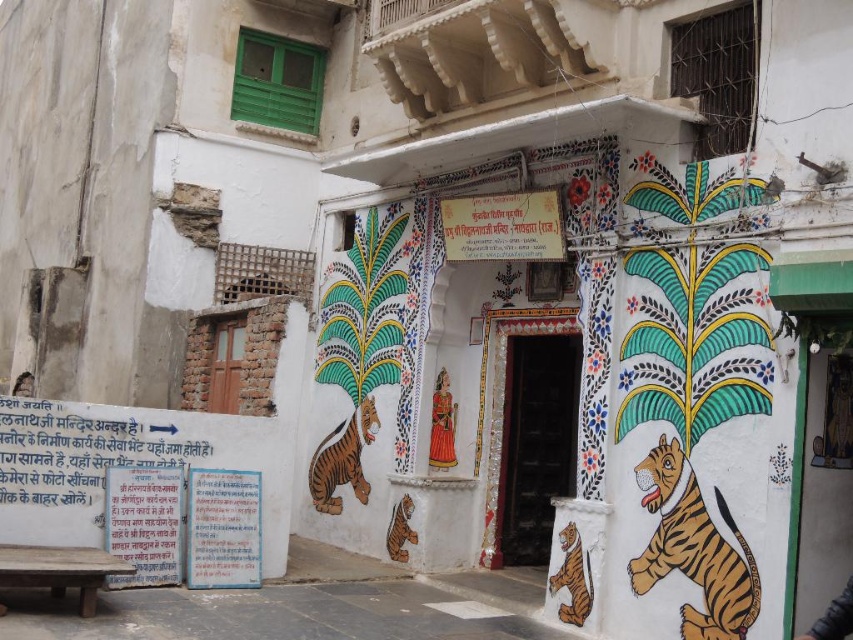
Question: Does polished wood statue at center have a smaller size compared to smooth skin face at lower left?

Choices:
 (A) no
 (B) yes

Answer: (B)

Question: Which object is closer to the camera taking this photo?

Choices:
 (A) polished wood statue at center
 (B) smooth skin face at lower left

Answer: (A)

Question: Which object appears closest to the camera in this image?

Choices:
 (A) smooth skin face at lower left
 (B) polished wood statue at center

Answer: (B)

Question: Is polished wood statue at center wider than smooth skin face at lower left?

Choices:
 (A) yes
 (B) no

Answer: (B)

Question: Is polished wood statue at center further to the viewer compared to smooth skin face at lower left?

Choices:
 (A) no
 (B) yes

Answer: (A)

Question: Which point is closer to the camera taking this photo?

Choices:
 (A) (28, 390)
 (B) (440, 467)

Answer: (B)